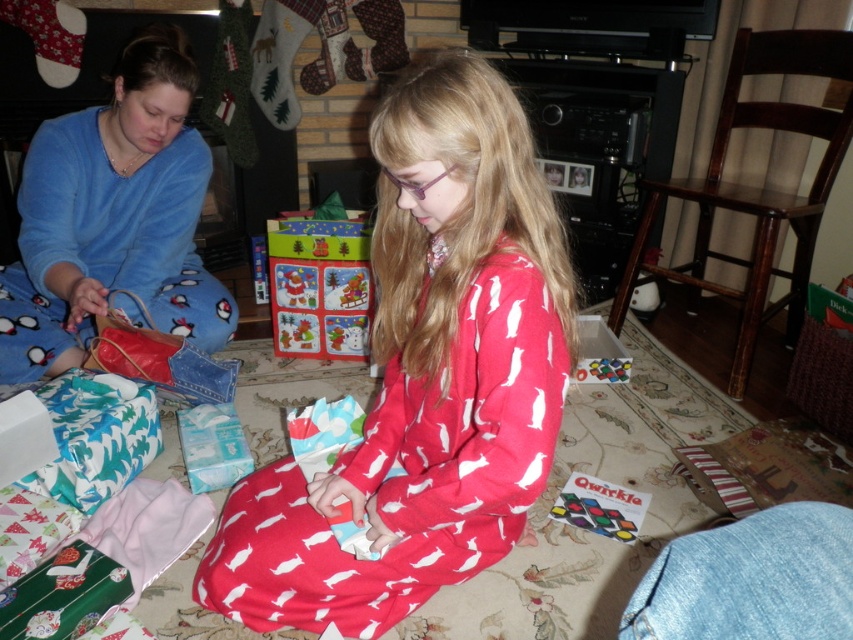
What do you see at coordinates (424, 376) in the screenshot? The width and height of the screenshot is (853, 640). I see `red flannel pajamas at center` at bounding box center [424, 376].

In order to click on red flannel pajamas at center in this screenshot , I will do 424,376.

This screenshot has width=853, height=640. What are the coordinates of `red flannel pajamas at center` in the screenshot? It's located at (424, 376).

Is blue fleece pajamas at left below faded denim jacket at lower right?

Incorrect, blue fleece pajamas at left is not positioned below faded denim jacket at lower right.

Between blue fleece pajamas at left and faded denim jacket at lower right, which one has less height?

Standing shorter between the two is faded denim jacket at lower right.

Does point (51, 177) come farther from viewer compared to point (808, 522)?

Yes, point (51, 177) is farther from viewer.

Identify the location of blue fleece pajamas at left. (113, 220).

Does red flannel pajamas at center have a greater width compared to christmas-themed paper gift at center?

Yes.

Based on the photo, is red flannel pajamas at center bigger than christmas-themed paper gift at center?

Correct, red flannel pajamas at center is larger in size than christmas-themed paper gift at center.

What are the coordinates of `red flannel pajamas at center` in the screenshot? It's located at (424, 376).